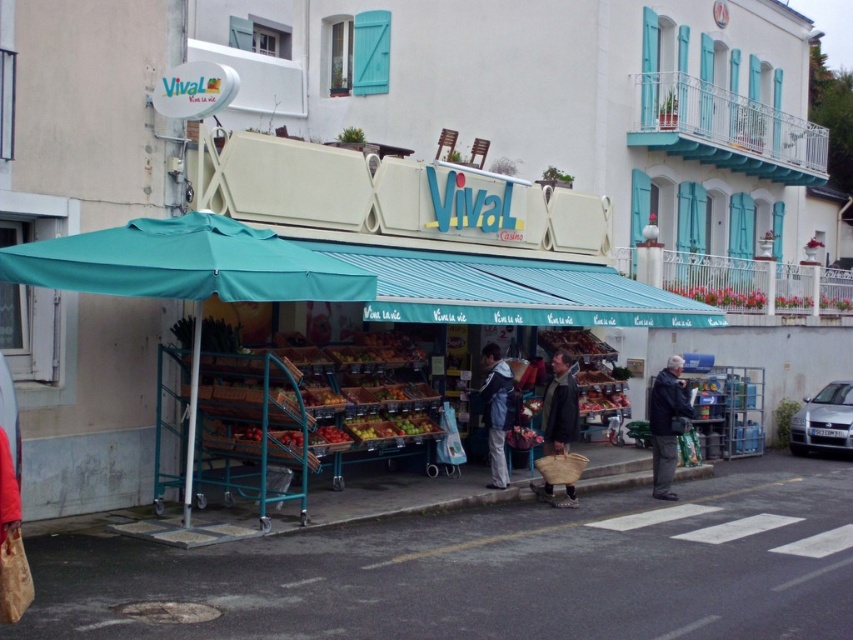
Question: Based on their relative distances, which object is nearer to the dark blue jacket at lower right?

Choices:
 (A) teal fabric umbrella at center
 (B) brown canvas bag at center

Answer: (B)

Question: Which object appears closest to the camera in this image?

Choices:
 (A) dark blue jacket at lower right
 (B) brown canvas bag at center

Answer: (B)

Question: Is the position of teal fabric canopy at left less distant than that of brown canvas bag at center?

Choices:
 (A) no
 (B) yes

Answer: (B)

Question: Does teal fabric canopy at left appear under dark blue jacket at lower right?

Choices:
 (A) no
 (B) yes

Answer: (A)

Question: Can you confirm if teal fabric umbrella at center is positioned below blue denim jacket at center?

Choices:
 (A) yes
 (B) no

Answer: (B)

Question: Which object is closer to the camera taking this photo?

Choices:
 (A) dark blue jacket at lower right
 (B) teal fabric umbrella at center
 (C) blue denim jacket at center

Answer: (B)